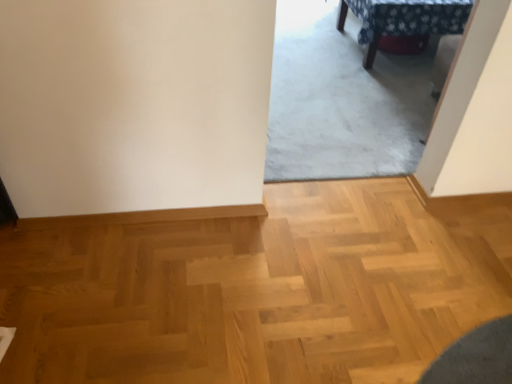
This screenshot has width=512, height=384. In order to click on free space in front of patterned fabric table at upper right in this screenshot , I will do `click(361, 102)`.